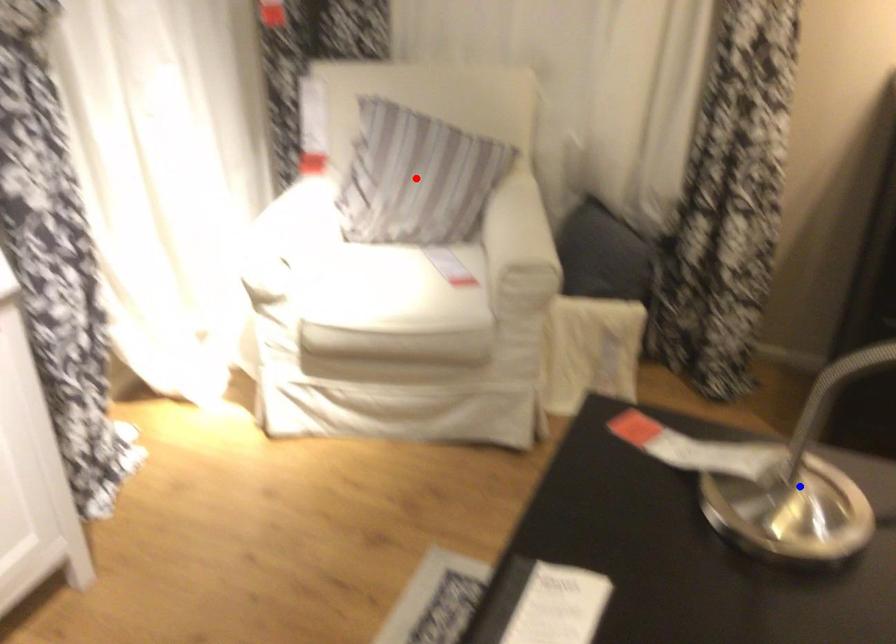
Question: Two points are marked on the image. Which point is closer to the camera?

Choices:
 (A) Blue point is closer.
 (B) Red point is closer.

Answer: (A)